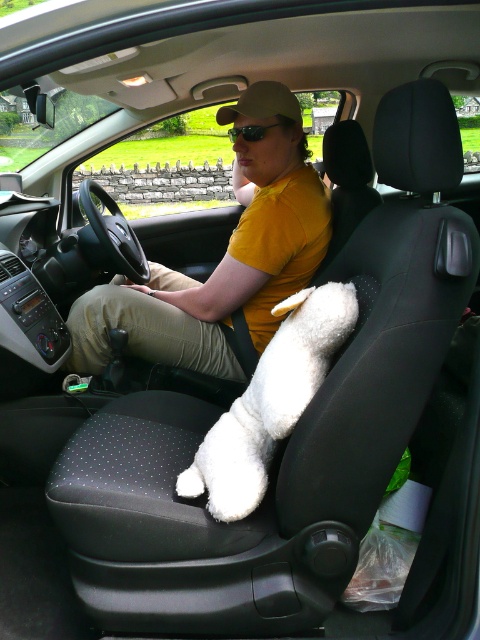
Question: Which of the following is the farthest from the observer?

Choices:
 (A) green reflective lens glasses at center
 (B) khaki fabric pants at center
 (C) yellow matte shirt at center
 (D) white fluffy dog at center

Answer: (B)

Question: Can you confirm if khaki fabric pants at center is positioned below green reflective lens glasses at center?

Choices:
 (A) yes
 (B) no

Answer: (A)

Question: Does white fluffy dog at center appear on the left side of green reflective lens glasses at center?

Choices:
 (A) yes
 (B) no

Answer: (B)

Question: Which point appears farthest from the camera in this image?

Choices:
 (A) (261, 132)
 (B) (321, 186)
 (C) (105, 301)

Answer: (C)

Question: Does yellow matte shirt at center come behind white fluffy dog at center?

Choices:
 (A) yes
 (B) no

Answer: (A)

Question: Which point is closer to the camera taking this photo?

Choices:
 (A) (157, 269)
 (B) (248, 140)

Answer: (B)